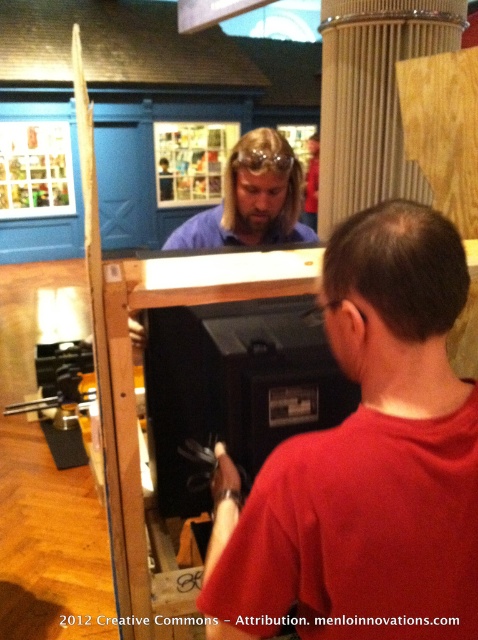
This screenshot has width=478, height=640. What do you see at coordinates (366, 460) in the screenshot? I see `red matte shirt at center` at bounding box center [366, 460].

Is point (237, 614) in front of point (250, 166)?

Yes, point (237, 614) is closer to viewer.

Where is `red matte shirt at center`? red matte shirt at center is located at coordinates (366, 460).

Who is taller, blue matte shirt at center or clear plastic goggles at center?

blue matte shirt at center is taller.

Who is more forward, (294, 214) or (241, 164)?

Point (241, 164) is in front.

Who is more forward, (182, 248) or (261, 150)?

Point (261, 150) is more forward.

The height and width of the screenshot is (640, 478). What are the coordinates of `blue matte shirt at center` in the screenshot? It's located at (251, 198).

In order to click on red matte shirt at center in this screenshot , I will do `click(366, 460)`.

Which is above, red matte shirt at center or clear plastic goggles at center?

Positioned higher is clear plastic goggles at center.

Who is more distant from viewer, (416, 627) or (280, 157)?

The point (280, 157) is more distant.

Locate an element on the screen. Image resolution: width=478 pixels, height=640 pixels. red matte shirt at center is located at coordinates (366, 460).